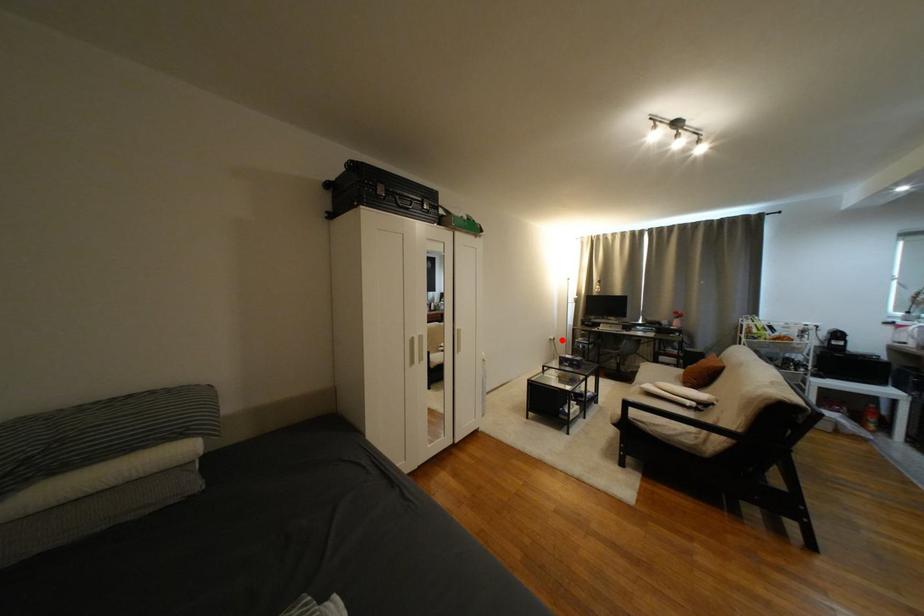
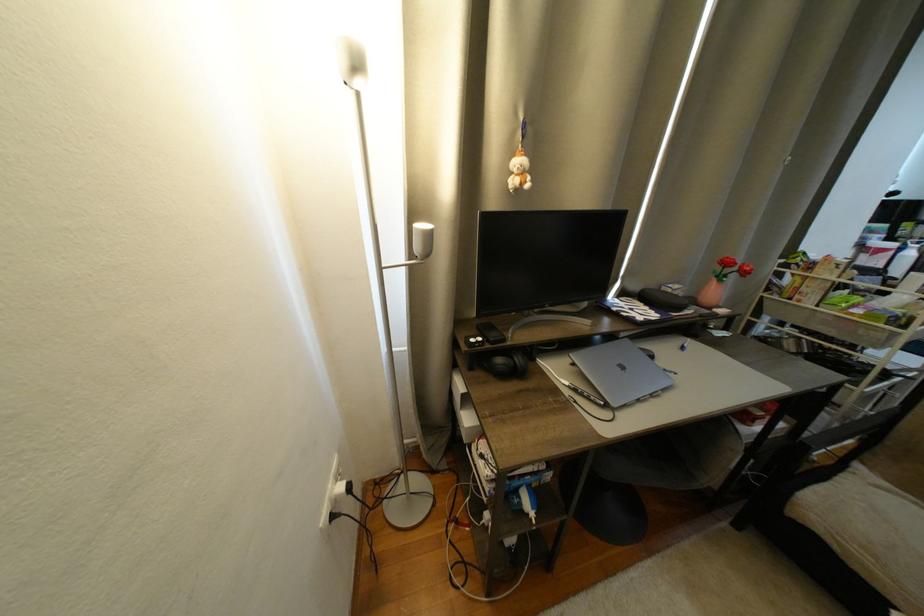
The point at the highlighted location is marked in the first image. Where is the corresponding point in the second image?

(358, 490)